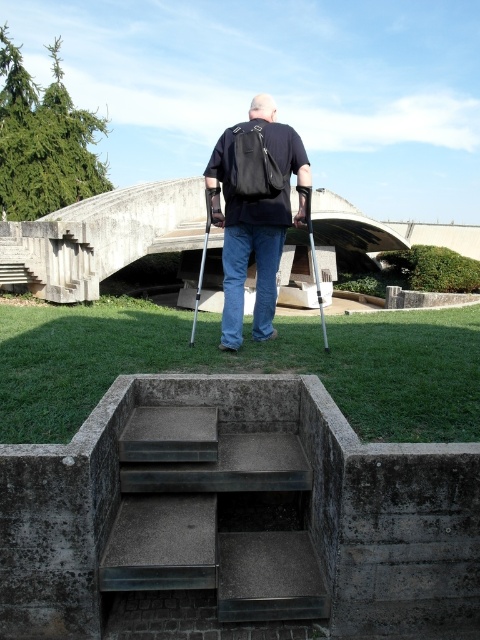
Question: In this image, where is metallic silver crutch at center located relative to silver metallic crutch at center?

Choices:
 (A) below
 (B) above

Answer: (A)

Question: Can you confirm if black matte backpack at center is bigger than metallic silver crutch at center?

Choices:
 (A) no
 (B) yes

Answer: (A)

Question: Can you confirm if black matte backpack at center is thinner than metallic silver crutch at center?

Choices:
 (A) no
 (B) yes

Answer: (B)

Question: Which point is closer to the camera?

Choices:
 (A) silver metallic crutch at center
 (B) black matte backpack at center
 (C) metallic silver crutch at center

Answer: (C)

Question: Which point is farther from the camera taking this photo?

Choices:
 (A) (324, 332)
 (B) (252, 339)
 (C) (197, 301)

Answer: (C)

Question: Which point is farther to the camera?

Choices:
 (A) silver metallic crutch at center
 (B) metallic silver crutch at center
 (C) black matte backpack at center

Answer: (A)